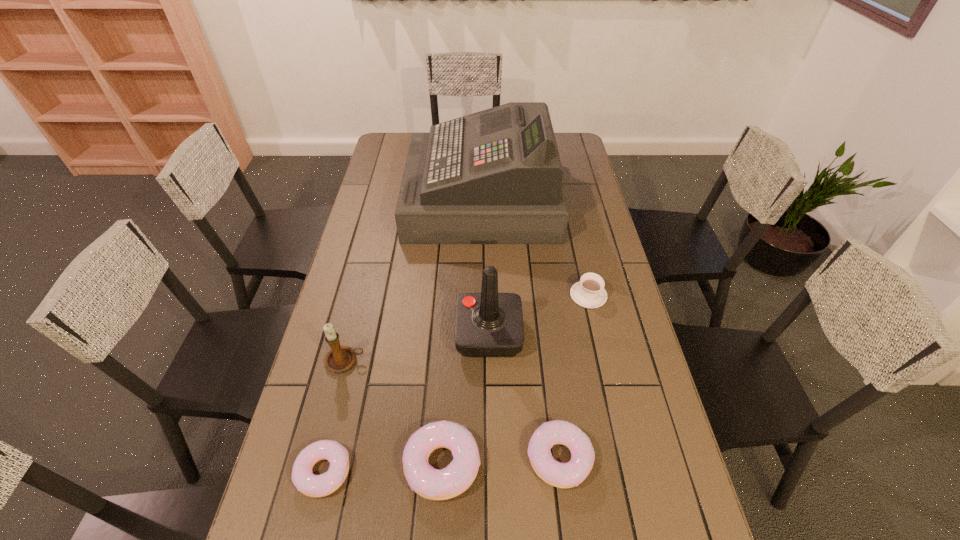
This screenshot has width=960, height=540. Find the location of `free space between the teacup and the second doughnut from right to left`. free space between the teacup and the second doughnut from right to left is located at coordinates (516, 380).

Locate an element on the screen. free spot between the sixth nearest object and the second tallest doughnut is located at coordinates (574, 376).

Find the location of `free area in between the shortest doughnut and the second doughnut from right to left`. free area in between the shortest doughnut and the second doughnut from right to left is located at coordinates (383, 468).

Locate an element on the screen. This screenshot has height=540, width=960. empty space that is in between the joystick and the rightmost doughnut is located at coordinates (524, 396).

This screenshot has height=540, width=960. In order to click on empty space between the shortest doughnut and the candle holder in this screenshot , I will do `click(334, 416)`.

I want to click on object that stands as the closest to the candle holder, so click(311, 485).

I want to click on the fifth closest object to the second tallest doughnut, so click(341, 358).

I want to click on the closest doughnut to the second doughnut from left to right, so click(562, 475).

At what (x,y) coordinates should I click in order to perform the action: click on the second closest doughnut to the second tallest doughnut. Please return your answer as a coordinate pair (x, y). This screenshot has height=540, width=960. Looking at the image, I should click on (311, 485).

At what (x,y) coordinates should I click in order to perform the action: click on vacant area that satisfies the following two spatial constraints: 1. on the back side of the rightmost doughnut; 2. on the right side of the second doughnut from right to left. Please return your answer as a coordinate pair (x, y). The width and height of the screenshot is (960, 540). Looking at the image, I should click on (444, 457).